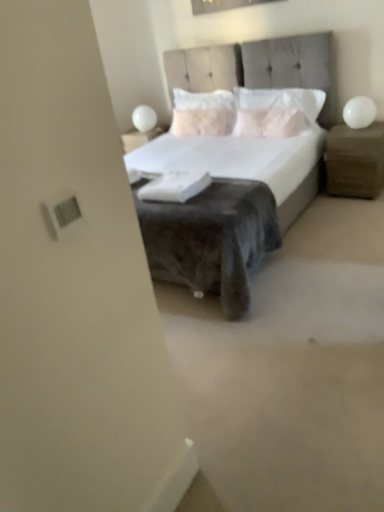
Where is `free spot in front of wooden nightstand at right`? free spot in front of wooden nightstand at right is located at coordinates (357, 208).